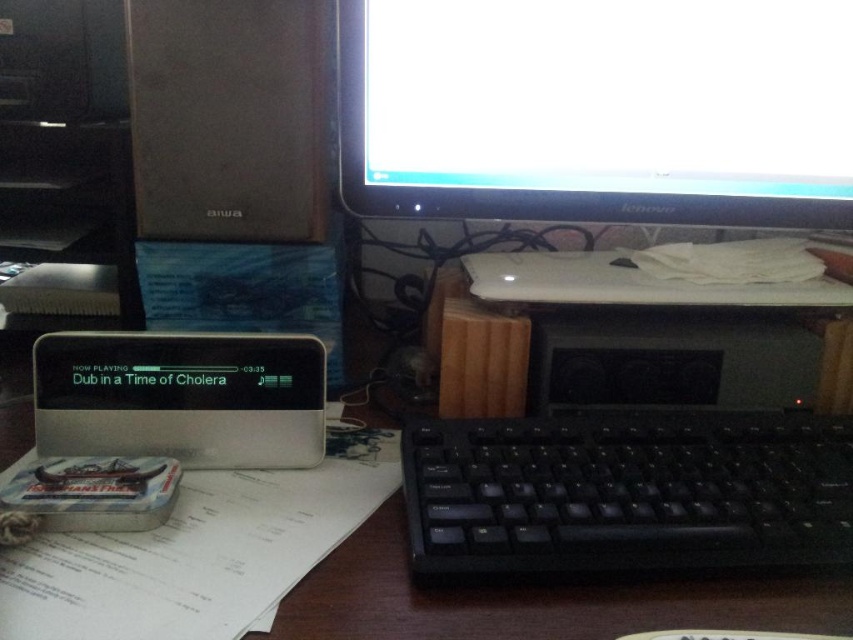
Question: Does black glossy monitor at upper center have a greater width compared to black plastic keyboard at center?

Choices:
 (A) no
 (B) yes

Answer: (B)

Question: Does black plastic keyboard at center have a lesser width compared to silver/black plastic computer at center?

Choices:
 (A) yes
 (B) no

Answer: (B)

Question: Which point appears farthest from the camera in this image?

Choices:
 (A) (527, 637)
 (B) (386, 8)
 (C) (779, 419)

Answer: (C)

Question: Which point is farther to the camera?

Choices:
 (A) silver/black plastic computer at center
 (B) black plastic keyboard at center

Answer: (B)

Question: Which of the following is the farthest from the observer?

Choices:
 (A) (410, 572)
 (B) (799, 598)
 (C) (792, 129)

Answer: (C)

Question: Is black plastic keyboard at center to the left of silver/black plastic computer at center from the viewer's perspective?

Choices:
 (A) yes
 (B) no

Answer: (B)